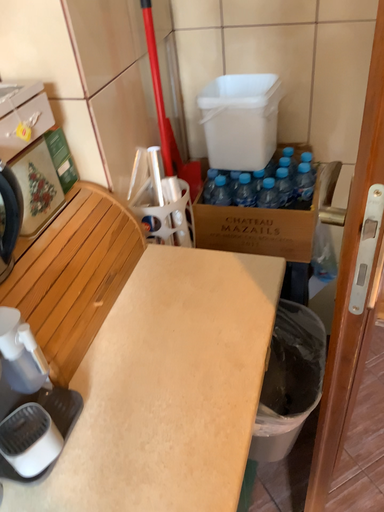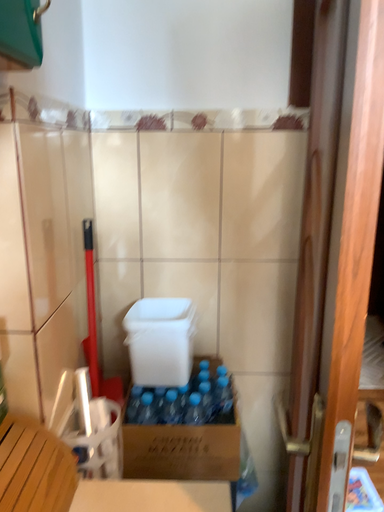
Question: Which way did the camera rotate in the video?

Choices:
 (A) rotated left
 (B) rotated right

Answer: (B)